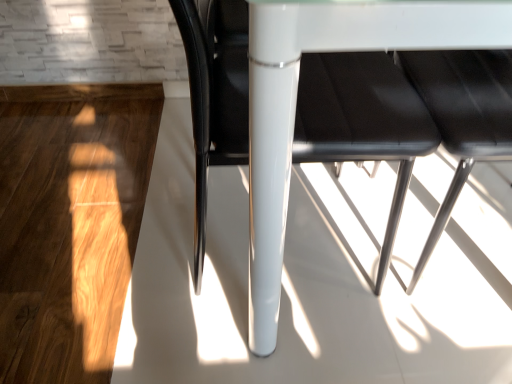
Find the location of a particular element. Image resolution: width=512 pixels, height=384 pixels. free point to the left of white glossy table at center is located at coordinates (98, 195).